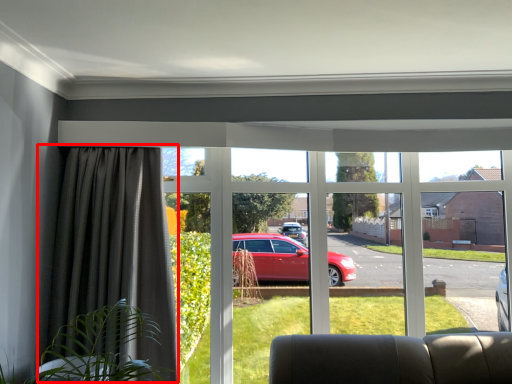
Question: From the image's perspective, what is the correct spatial relationship of curtain (annotated by the red box) in relation to window?

Choices:
 (A) above
 (B) below

Answer: (A)